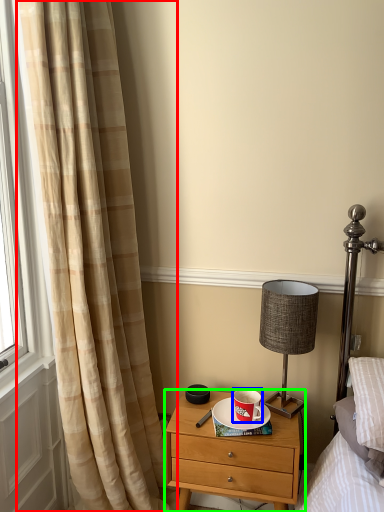
Question: Which object is positioned farthest from curtain (highlighted by a red box)? Select from coffee cup (highlighted by a blue box) and nightstand (highlighted by a green box).

Choices:
 (A) coffee cup
 (B) nightstand

Answer: (A)